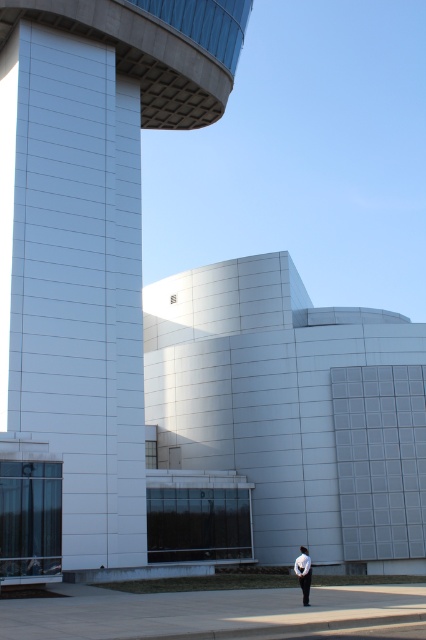
You are a construction worker standing at the base of the white glossy tower at center. You need to deliver a tool to the person wearing the white matte shirt at center, who is standing 61.58 feet away. If your tool has a maximum throwing distance of 60 feet, can you reach them by throwing the tool?

The distance between the white glossy tower at center and the white matte shirt at center is 61.58 feet, which exceeds the tool throwing range of 60 feet. Therefore, you cannot reach them by throwing the tool.

You are standing in front of the modern building and see the white glossy tower at center and the white matte shirt at center. Which object is positioned to the left?

The white glossy tower at center is to the left of the white matte shirt at center.

You are standing at the entrance of the modern architectural structure. You see the white glossy tower at center marked by point [86,253]. If you turn 90 degrees to your right, will the tower still be visible in your field of view?

The white glossy tower at center is represented by point [86,253]. Turning 90 degrees to your right would change your facing direction, but since the tower is at the center of the scene, it might still be visible depending on the building layout. However, without specific information about the building structure, we cannot confirm visibility.